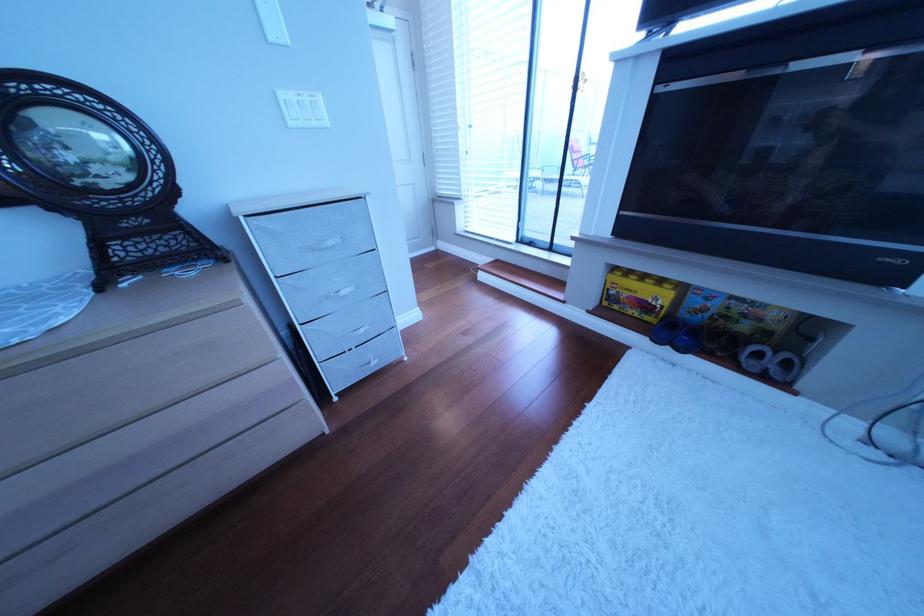
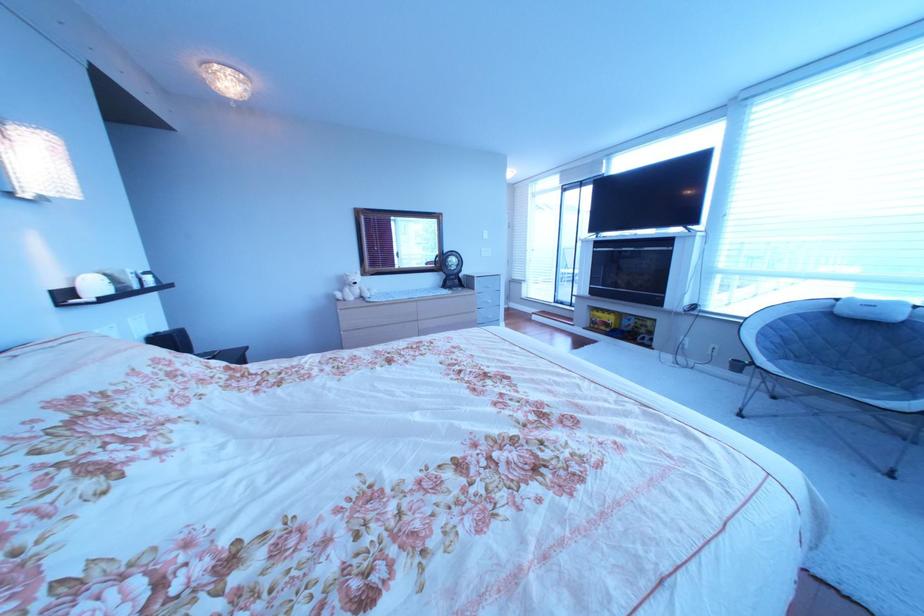
Question: In a continuous first-person perspective shot, in which direction is the camera moving?

Choices:
 (A) Left
 (B) Right
 (C) Forward
 (D) Backward

Answer: (D)